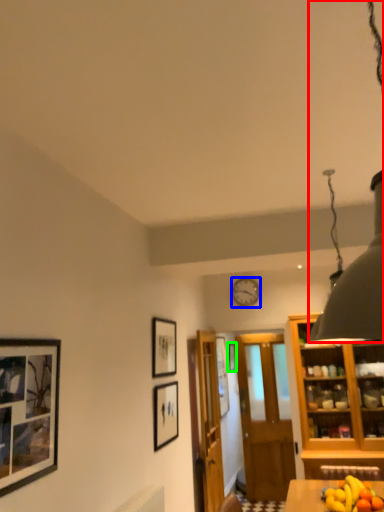
Question: Which object is positioned farthest from light fixture (highlighted by a red box)? Select from picture frame (highlighted by a blue box) and picture frame (highlighted by a green box).

Choices:
 (A) picture frame
 (B) picture frame

Answer: (B)